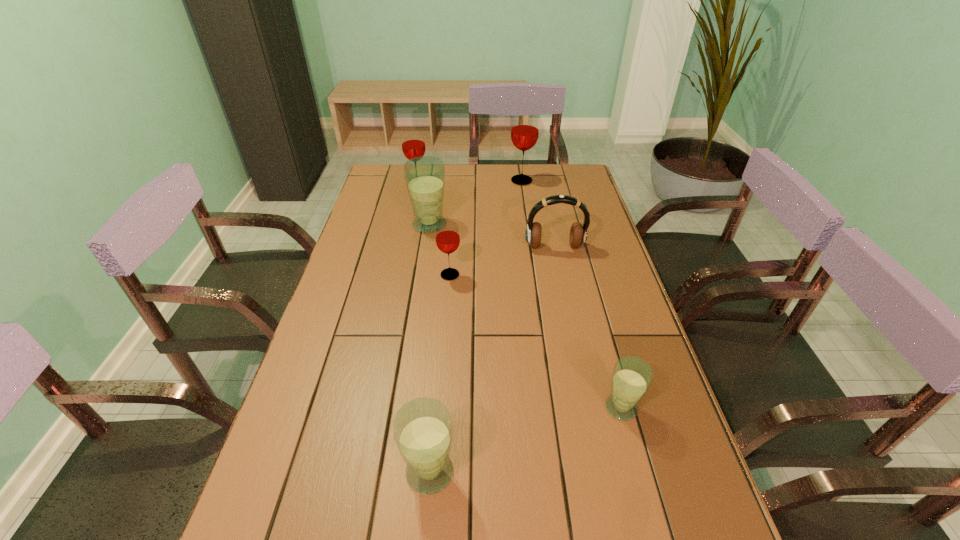
Locate an element on the screen. red glass that is the second closest to the nearest blue glass is located at coordinates (413, 143).

The image size is (960, 540). In order to click on blue glass that stands as the second closest to the fifth farthest glass in this screenshot , I will do `click(425, 176)`.

Identify which blue glass is the second nearest to the fifth nearest object. Please provide its 2D coordinates. Your answer should be formatted as a tuple, i.e. [(x, y)], where the tuple contains the x and y coordinates of a point satisfying the conditions above.

[(422, 428)]

Locate an element on the screen. The width and height of the screenshot is (960, 540). blank space that satisfies the following two spatial constraints: 1. on the front side of the nearest red glass; 2. on the right side of the second nearest blue glass is located at coordinates (440, 408).

You are a GUI agent. You are given a task and a screenshot of the screen. Output one action in this format:
    pyautogui.click(x=<x>, y=<y>)
    Task: Click on the free space in the image that satisfies the following two spatial constraints: 1. on the back side of the nearest object; 2. on the right side of the tallest glass
    
    Given the screenshot: What is the action you would take?
    pyautogui.click(x=455, y=181)

The height and width of the screenshot is (540, 960). I want to click on free spot that satisfies the following two spatial constraints: 1. on the front side of the smallest red glass; 2. on the left side of the second biggest red glass, so click(x=399, y=275).

Where is `vacant space that satisfies the following two spatial constraints: 1. on the back side of the second red glass from right to left; 2. on the right side of the nearest blue glass`? This screenshot has height=540, width=960. vacant space that satisfies the following two spatial constraints: 1. on the back side of the second red glass from right to left; 2. on the right side of the nearest blue glass is located at coordinates (446, 275).